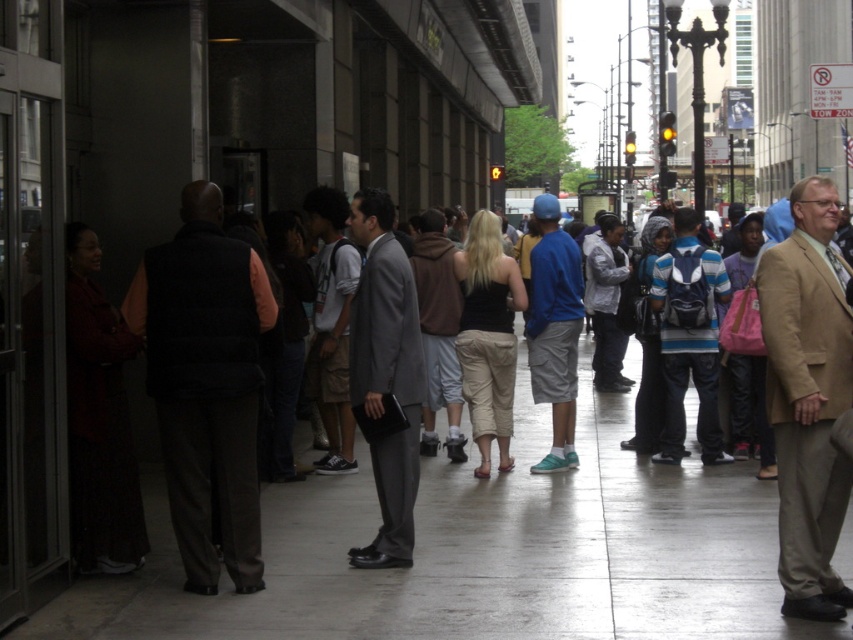
Looking at this image, you are a delivery person needing to walk through the sidewalk while carrying a large box. The box is as wide as the gray suit at center. Can you walk through the concrete sidewalk at center without the box hitting the edges?

The concrete sidewalk at center might be wider than gray suit at center, so the box, which is as wide as the gray suit at center, should fit within the sidewalk width without hitting the edges.

You are standing at the point marked as point (482, 554) in the image. What type of surface are you standing on?

You are standing on the concrete sidewalk at center located at point (482, 554).

You are standing at the point marked by the coordinates point (206, 384) in the scene. What object is located at that position?

The point (206, 384) marks the location of the dark gray vest at left.